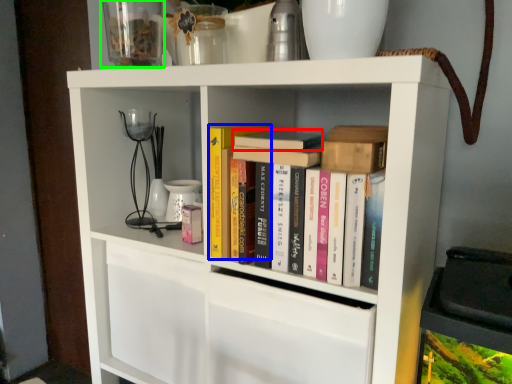
Question: Estimate the real-world distances between objects in this image. Which object is closer to book (highlighted by a red box), paperback book (highlighted by a blue box) or glass vase (highlighted by a green box)?

Choices:
 (A) paperback book
 (B) glass vase

Answer: (A)